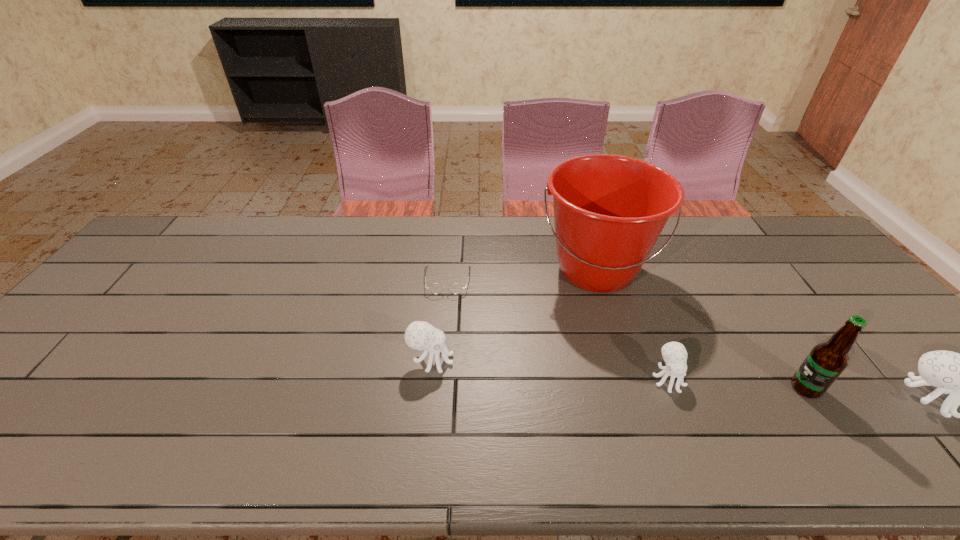
Identify the location of octopus object that ranks as the third closest to the beer bottle. The image size is (960, 540). (419, 335).

The image size is (960, 540). I want to click on octopus that can be found as the closest to the shortest object, so click(419, 335).